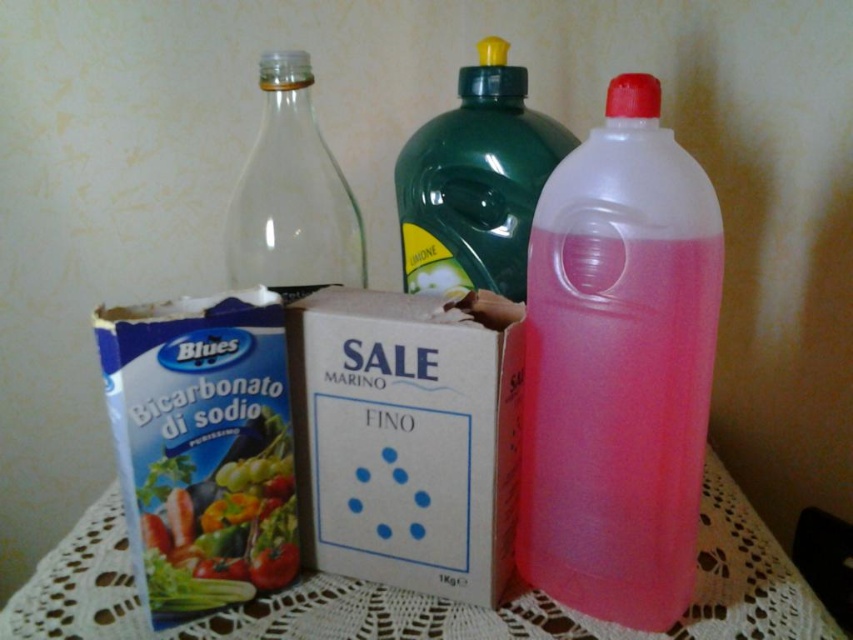
Does white lace tablecloth at lower center lie behind green translucent bottle at center?

No, white lace tablecloth at lower center is closer to the viewer.

Where is `white lace tablecloth at lower center`? white lace tablecloth at lower center is located at coordinates (419, 595).

The width and height of the screenshot is (853, 640). In order to click on white lace tablecloth at lower center in this screenshot , I will do `click(419, 595)`.

Is green translucent bottle at center in front of transparent glass bottle at center?

Yes.

Does point (440, 188) come closer to viewer compared to point (308, 280)?

Yes, it is in front of point (308, 280).

Identify the location of green translucent bottle at center. This screenshot has height=640, width=853. (474, 180).

Locate an element on the screen. white cardboard box at center is located at coordinates (404, 440).

Identify the location of white cardboard box at center. (404, 440).